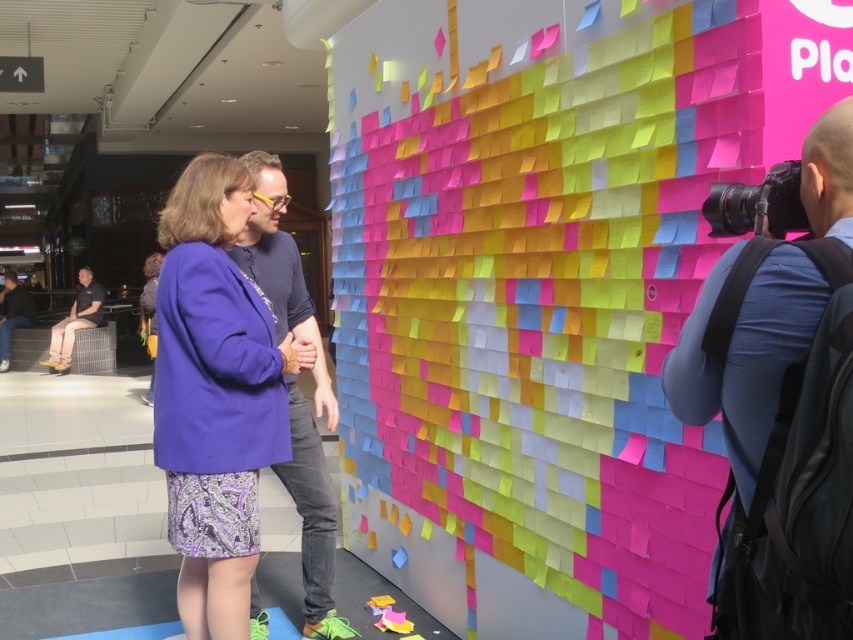
Is blue fabric camera at right above matte black shirt at center?

Indeed, blue fabric camera at right is positioned over matte black shirt at center.

Which is above, blue fabric camera at right or matte black shirt at center?

blue fabric camera at right

Between point (798, 586) and point (312, 474), which one is positioned in front?

Point (798, 586) is more forward.

Where is `blue fabric camera at right`? The image size is (853, 640). blue fabric camera at right is located at coordinates (781, 408).

Can you confirm if khaki cotton pants at lower left is wider than dark gray jeans at lower left?

Incorrect, khaki cotton pants at lower left's width does not surpass dark gray jeans at lower left's.

Between khaki cotton pants at lower left and dark gray jeans at lower left, which one is positioned lower?

Positioned lower is khaki cotton pants at lower left.

Which is behind, point (62, 355) or point (9, 353)?

Point (9, 353)

This screenshot has width=853, height=640. Find the location of `khaki cotton pants at lower left`. khaki cotton pants at lower left is located at coordinates (74, 321).

Between purple fabric skirt at center and purple soft fabric sweatshirt at center, which one appears on the left side from the viewer's perspective?

purple soft fabric sweatshirt at center is more to the left.

Is point (207, 563) behind point (224, 292)?

Yes, it is behind point (224, 292).

Find the location of a particular element. The image size is (853, 640). purple fabric skirt at center is located at coordinates (215, 394).